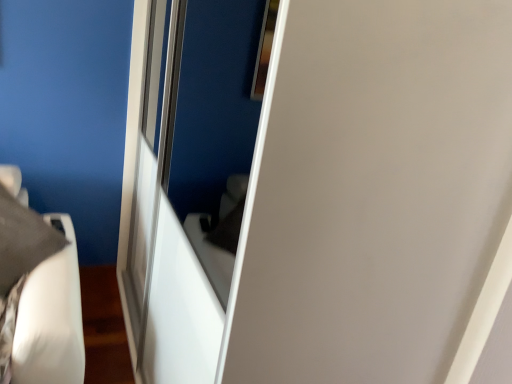
The image size is (512, 384). What do you see at coordinates (37, 293) in the screenshot?
I see `matte gray pillow at left` at bounding box center [37, 293].

Locate an element on the screen. The image size is (512, 384). matte gray pillow at left is located at coordinates (37, 293).

This screenshot has height=384, width=512. What are the coordinates of `matte gray pillow at left` in the screenshot? It's located at (37, 293).